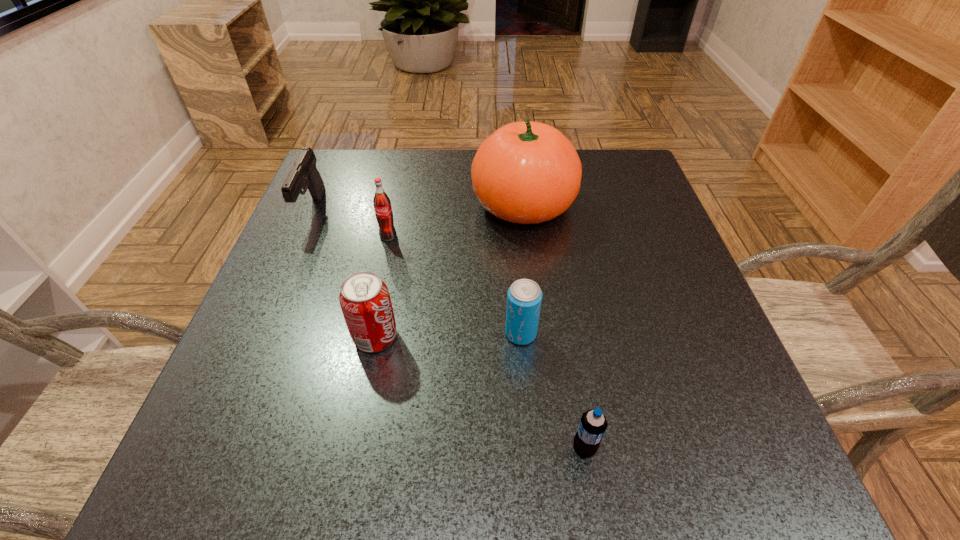
Where is `free spot at the far left corner of the desktop`? free spot at the far left corner of the desktop is located at coordinates (384, 165).

Where is `free space at the near left corner of the desktop`? This screenshot has width=960, height=540. free space at the near left corner of the desktop is located at coordinates (246, 455).

Find the location of `free space at the far right corner of the desktop`. free space at the far right corner of the desktop is located at coordinates tap(627, 154).

You are a GUI agent. You are given a task and a screenshot of the screen. Output one action in this format:
    pyautogui.click(x=<x>, y=<y>)
    Task: Click on the free space that is in between the leftmost object and the pumpkin
    This screenshot has width=960, height=540.
    Given the screenshot: What is the action you would take?
    (418, 207)

The width and height of the screenshot is (960, 540). I want to click on free area in between the farthest soda bottle and the leftmost object, so click(x=350, y=223).

Where is `vacant space that is in between the tallest object and the nearest object`? This screenshot has width=960, height=540. vacant space that is in between the tallest object and the nearest object is located at coordinates (554, 326).

Identify the location of free space between the rightmost soda bottle and the tallest object. Image resolution: width=960 pixels, height=540 pixels. (554, 326).

Where is `vacant region between the farthest soda bottle and the rightmost soda bottle`? This screenshot has height=540, width=960. vacant region between the farthest soda bottle and the rightmost soda bottle is located at coordinates (486, 342).

Locate an element on the screen. free spot between the farthest soda bottle and the second soda bottle from right to left is located at coordinates (454, 285).

Identify which object is located as the fourth nearest to the tallest object. Please provide its 2D coordinates. Your answer should be formatted as a tuple, i.e. [(x, y)], where the tuple contains the x and y coordinates of a point satisfying the conditions above.

[(304, 174)]